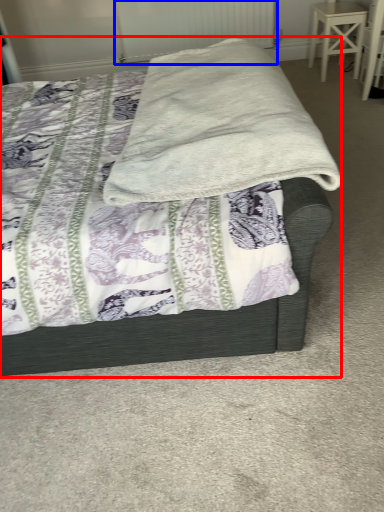
Question: Among these objects, which one is nearest to the camera, bed (highlighted by a red box) or radiator (highlighted by a blue box)?

Choices:
 (A) bed
 (B) radiator

Answer: (A)